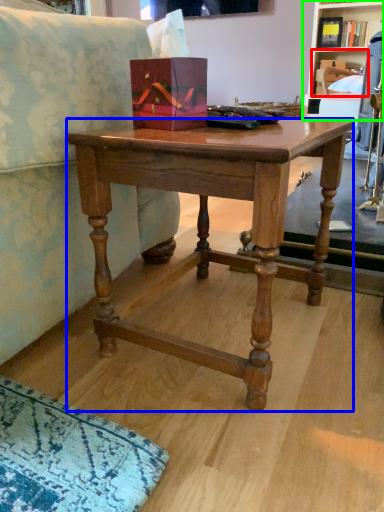
Question: Considering the real-world distances, which object is farthest from shelf (highlighted by a red box)? desk (highlighted by a blue box) or shelf (highlighted by a green box)?

Choices:
 (A) desk
 (B) shelf

Answer: (A)